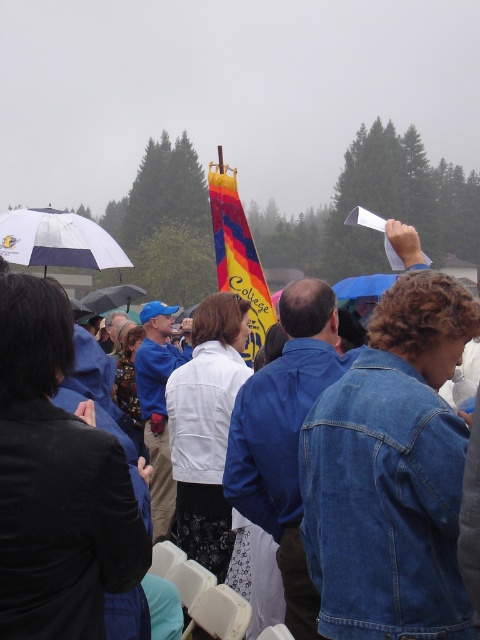
You are a photographer trying to capture a clear shot of both the denim jacket at lower right and the black matte umbrella at center. Since you want to focus on the umbrella, which object should you adjust your camera focus to prioritize?

The denim jacket at lower right is closer to the viewer than the black matte umbrella at center. To prioritize focusing on the black matte umbrella at center, you should adjust your camera focus to the distance of the black matte umbrella at center.

You are a photographer at the event and want to capture a photo of the rainbow fabric flag at center without any obstructions. Given that the whiteumbrella at upper left is above it, can you adjust your angle to avoid the umbrella?

The whiteumbrella at upper left is located above the rainbow fabric flag at center, so you can move your camera position lower or shift to the side to avoid capturing the umbrella in the frame.